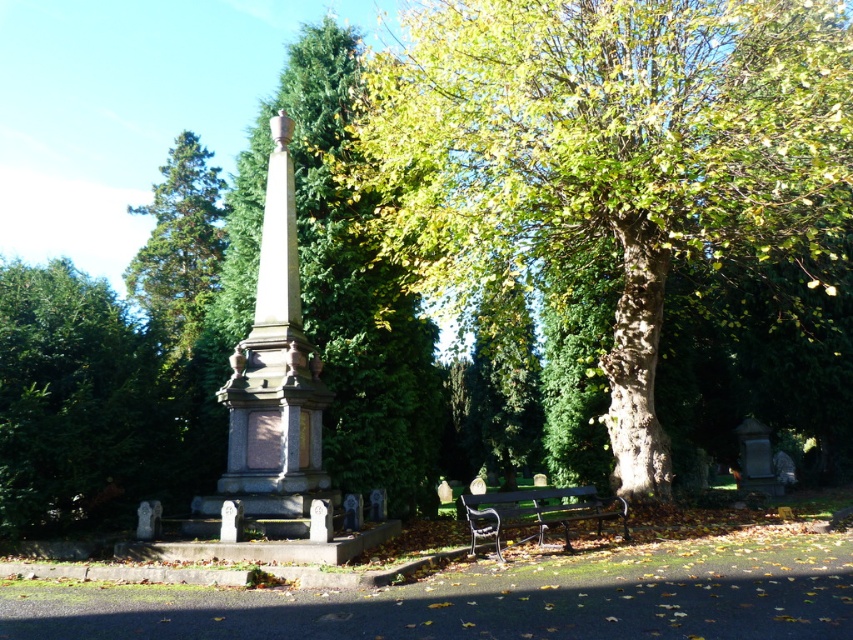
You are a visitor at the cemetery and want to take a photo of the polished stone obelisk at center without the green textured tree at center blocking it. Which direction should you move to ensure the tree is out of frame?

Move to the left side of the polished stone obelisk at center so that the green textured tree at center, which is positioned to its right, is no longer in the frame.

You are a landscape architect designing a new garden layout. You need to place a statue that is 2 meters tall in this area. Given the sizes of the green rough bark tree at center and the polished stone obelisk at center, which object should the statue be placed closer to to ensure it doesn

The polished stone obelisk at center is larger than the green rough bark tree at center. Therefore, placing the statue closer to the polished stone obelisk at center would maintain visual balance since the statue and the larger obelisk would complement each other in scale.

You are standing at the point closest to the large tree with a thick trunk. You want to walk towards the monument. Which point, point (532, 122) or point (328, 493), is closer to your starting position?

Point (328, 493) is closer to your starting position because it is in front of point (532, 122).